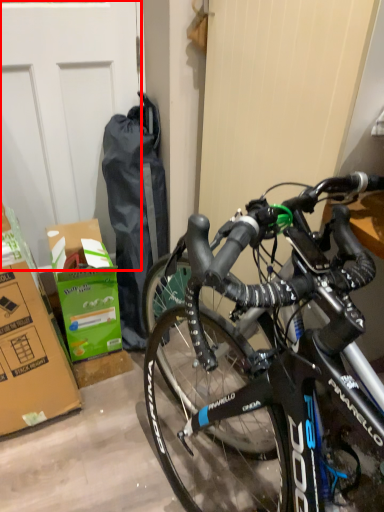
Question: Observing the image, what is the correct spatial positioning of garage door (annotated by the red box) in reference to cardboard box?

Choices:
 (A) right
 (B) left

Answer: (B)